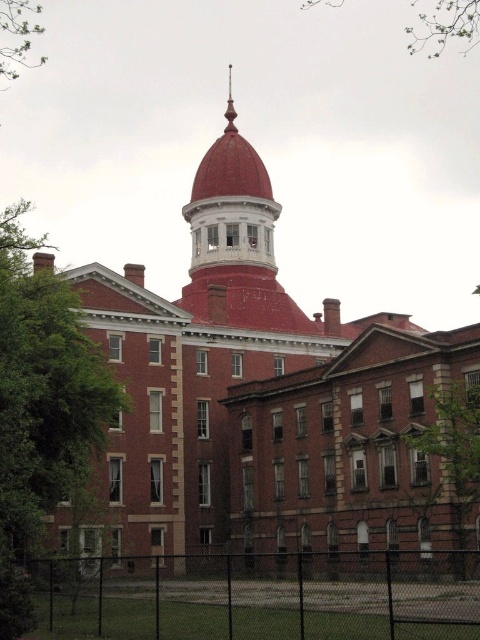
Question: Observing the image, what is the correct spatial positioning of green leafy branches at upper center in reference to green leafy tree at upper left?

Choices:
 (A) right
 (B) left

Answer: (A)

Question: Among these points, which one is farthest from the camera?

Choices:
 (A) (471, 48)
 (B) (24, 58)
 (C) (472, 392)
 (D) (51, 608)

Answer: (B)

Question: Which object is farther from the camera taking this photo?

Choices:
 (A) green leafy tree at lower right
 (B) black chain-link fence at lower center
 (C) green leafy tree at upper left
 (D) green leafy branches at upper center

Answer: (C)

Question: Which of the following is the closest to the observer?

Choices:
 (A) green leafy tree at lower right
 (B) green leafy tree at upper left
 (C) green leafy branches at upper center
 (D) black chain-link fence at lower center

Answer: (D)

Question: Is black chain-link fence at lower center closer to the viewer compared to green leafy branches at upper center?

Choices:
 (A) yes
 (B) no

Answer: (A)

Question: Is green leafy tree at lower right positioned before green leafy branches at upper center?

Choices:
 (A) yes
 (B) no

Answer: (A)